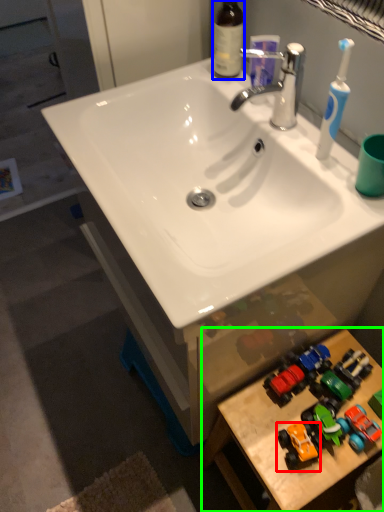
Question: Based on their relative distances, which object is nearer to toy (highlighted by a red box)? Choose from bottle (highlighted by a blue box) and table (highlighted by a green box).

Choices:
 (A) bottle
 (B) table

Answer: (B)